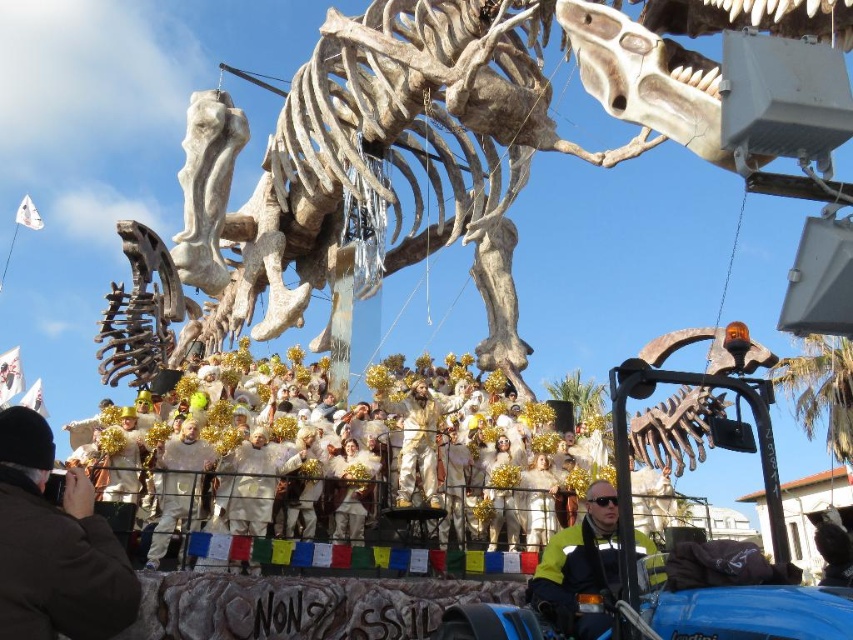
You are a photographer trying to capture the entire scene of the parade. You notice the yellow reflective jacket at lower center and the gold metallic costume at center. Which of these two items should you adjust your camera angle to ensure both are fully visible in your shot?

Since the yellow reflective jacket at lower center occupies less space than the gold metallic costume at center, you should adjust your camera angle to focus more on the larger gold metallic costume at center to ensure both items are fully visible in the shot.

You are an event organizer planning to place a large banner on the platform where the black fabric at lower left and the gold metallic costume at center are located. Which object should you avoid placing the banner near if you want to ensure the banner is not obstructed by the other object?

You should avoid placing the banner near the black fabric at lower left because it is bigger than the gold metallic costume at center and might obstruct the banner.

You are a participant in the parade and you want to place a decorative flag at the exact center of the image. However, you must avoid placing it near the black fabric at lower left. Based on the coordinates provided, is the center of the image at point 0.5, 0.5 safe to place the flag?

The black fabric at lower left is located at point (54, 545). The center of the image is at (426, 320), which is far enough from the black fabric at lower left to safely place the flag there.